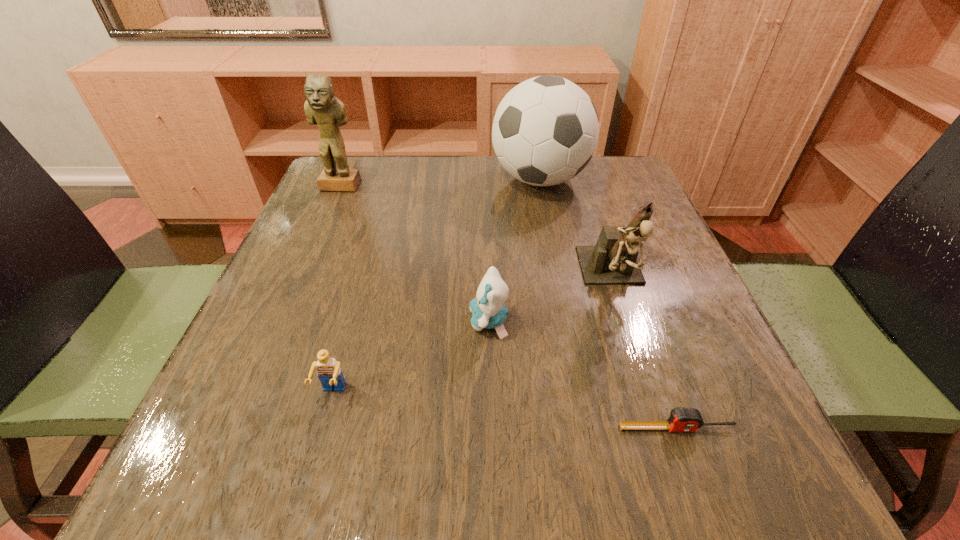
Identify the location of the farther figurine. Image resolution: width=960 pixels, height=540 pixels. (322, 108).

Image resolution: width=960 pixels, height=540 pixels. Identify the location of the left figurine. (322, 108).

In order to click on soccer ball in this screenshot , I will do [x=545, y=131].

The height and width of the screenshot is (540, 960). Find the location of `the shorter figurine`. the shorter figurine is located at coordinates (613, 260).

Locate an element on the screen. This screenshot has height=540, width=960. the nearer figurine is located at coordinates (613, 260).

Image resolution: width=960 pixels, height=540 pixels. What are the coordinates of `the third shortest object` in the screenshot? It's located at (x=488, y=310).

In order to click on Lego in this screenshot , I will do `click(329, 372)`.

At what (x,y) coordinates should I click in order to perform the action: click on the second object from left to right. Please return your answer as a coordinate pair (x, y). Looking at the image, I should click on (329, 372).

Locate an element on the screen. The width and height of the screenshot is (960, 540). the shortest object is located at coordinates coord(681,419).

Image resolution: width=960 pixels, height=540 pixels. I want to click on the nearest object, so click(681, 419).